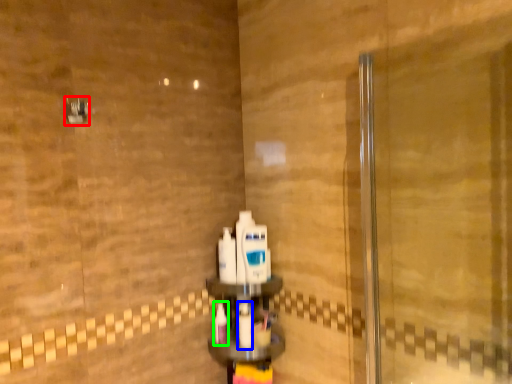
Question: Which object is the farthest from shower (highlighted by a red box)? Choose among these: mouthwash (highlighted by a blue box) or toothbrush (highlighted by a green box).

Choices:
 (A) mouthwash
 (B) toothbrush

Answer: (A)